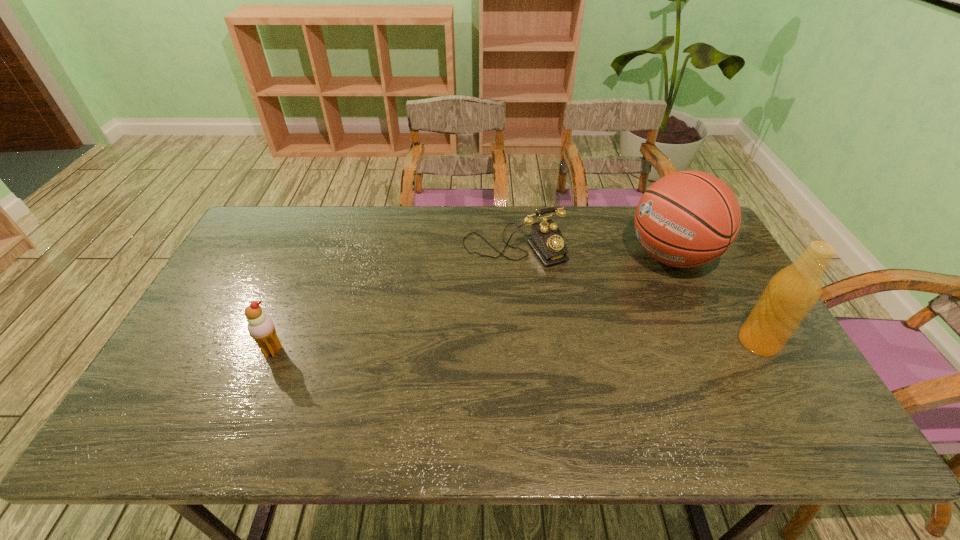
Where is `vacant space on the desktop that is between the leftmost object and the beer bottle and is positioned on the dial of the shortest object`? Image resolution: width=960 pixels, height=540 pixels. vacant space on the desktop that is between the leftmost object and the beer bottle and is positioned on the dial of the shortest object is located at coordinates (581, 345).

Find the location of a particular element. free space on the desktop that is between the icecream and the beer bottle and is positioned on the logo side of the basketball is located at coordinates (511, 346).